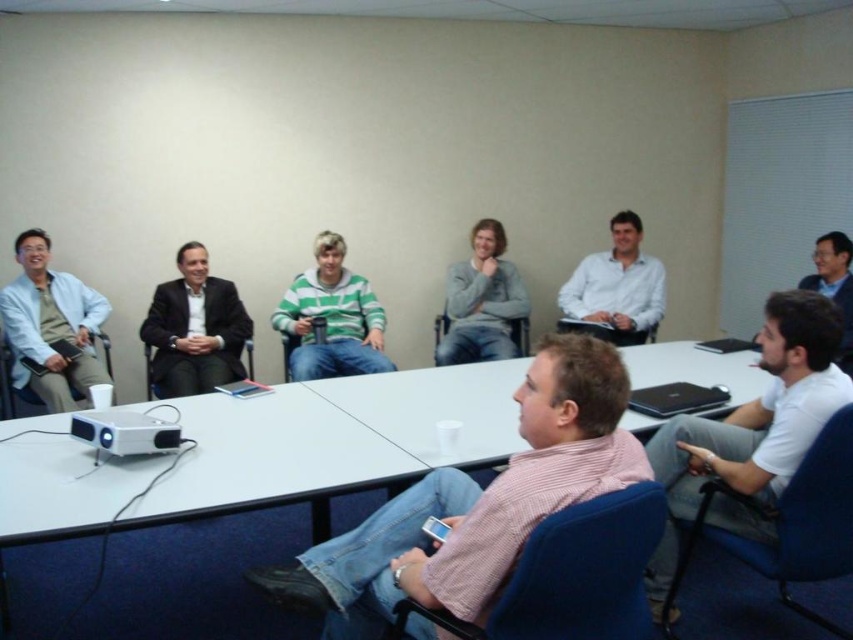
Question: Can you confirm if dark suit jacket at center is wider than white smooth shirt at center?

Choices:
 (A) no
 (B) yes

Answer: (A)

Question: Which point is farther to the camera?

Choices:
 (A) (329, 337)
 (B) (210, 376)
 (C) (828, 628)
 (D) (605, 268)

Answer: (D)

Question: Can you confirm if blue fabric chair at lower right is positioned to the right of matte gray chair at center?

Choices:
 (A) yes
 (B) no

Answer: (A)

Question: Which point is closer to the camera taking this photo?

Choices:
 (A) (526, 328)
 (B) (569, 324)

Answer: (B)

Question: Among these objects, which one is farthest from the camera?

Choices:
 (A) black fabric chair at center
 (B) green striped sweater at center

Answer: (A)

Question: Does matte white coat at upper left appear over green striped sweater at center?

Choices:
 (A) no
 (B) yes

Answer: (A)